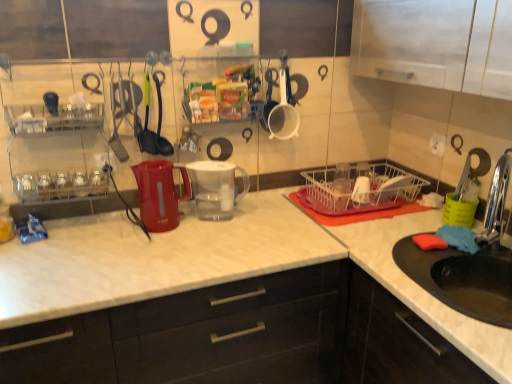
Question: Would you say transparent plastic cups at center, which is the 1th tableware in right-to-left order, contains matte white countertop at center, the second cabinetry in the right-to-left sequence?

Choices:
 (A) no
 (B) yes

Answer: (A)

Question: Can you confirm if transparent plastic cups at center, which is the 1th tableware in right-to-left order, is taller than matte white countertop at center, the second cabinetry in the right-to-left sequence?

Choices:
 (A) yes
 (B) no

Answer: (B)

Question: From a real-world perspective, is transparent plastic cups at center, which is the 1th tableware in right-to-left order, located higher than matte white countertop at center, the second cabinetry in the right-to-left sequence?

Choices:
 (A) no
 (B) yes

Answer: (B)

Question: Considering the relative positions of transparent plastic cups at center, the 4th tableware from the left, and matte white countertop at center, the second cabinetry in the right-to-left sequence, in the image provided, is transparent plastic cups at center, the 4th tableware from the left, to the right of matte white countertop at center, the second cabinetry in the right-to-left sequence, from the viewer's perspective?

Choices:
 (A) no
 (B) yes

Answer: (B)

Question: Does transparent plastic cups at center, which is the 1th tableware in right-to-left order, have a larger size compared to matte white countertop at center, placed as the 1th cabinetry when sorted from left to right?

Choices:
 (A) yes
 (B) no

Answer: (B)

Question: From the image's perspective, is transparent plastic cups at center, the 4th tableware from the left, beneath matte white countertop at center, the second cabinetry in the right-to-left sequence?

Choices:
 (A) yes
 (B) no

Answer: (B)

Question: Can you confirm if white wire basket at center is taller than clear plastic shelf at center?

Choices:
 (A) no
 (B) yes

Answer: (A)

Question: Considering the relative sizes of white wire basket at center and clear plastic shelf at center in the image provided, is white wire basket at center bigger than clear plastic shelf at center?

Choices:
 (A) yes
 (B) no

Answer: (A)

Question: Can you confirm if white wire basket at center is positioned to the right of clear plastic shelf at center?

Choices:
 (A) yes
 (B) no

Answer: (A)

Question: Is white wire basket at center at the left side of clear plastic shelf at center?

Choices:
 (A) no
 (B) yes

Answer: (A)

Question: Is white wire basket at center wider than clear plastic shelf at center?

Choices:
 (A) yes
 (B) no

Answer: (A)

Question: From a real-world perspective, is white wire basket at center located higher than clear plastic shelf at center?

Choices:
 (A) no
 (B) yes

Answer: (A)

Question: Could you tell me if matte white countertop at center, placed as the 1th cabinetry when sorted from left to right, is facing chrome metallic faucet at sink right?

Choices:
 (A) no
 (B) yes

Answer: (A)